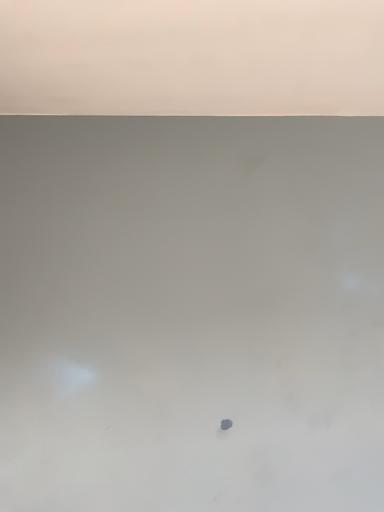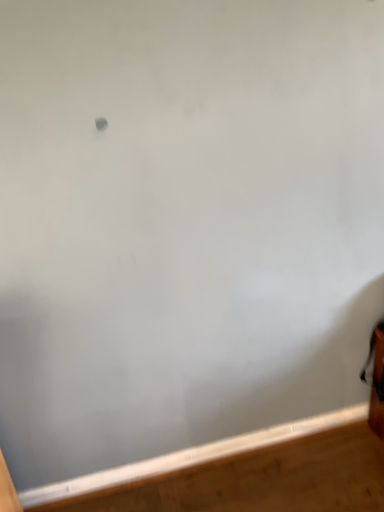
Question: Which way did the camera rotate in the video?

Choices:
 (A) rotated upward
 (B) rotated downward

Answer: (B)